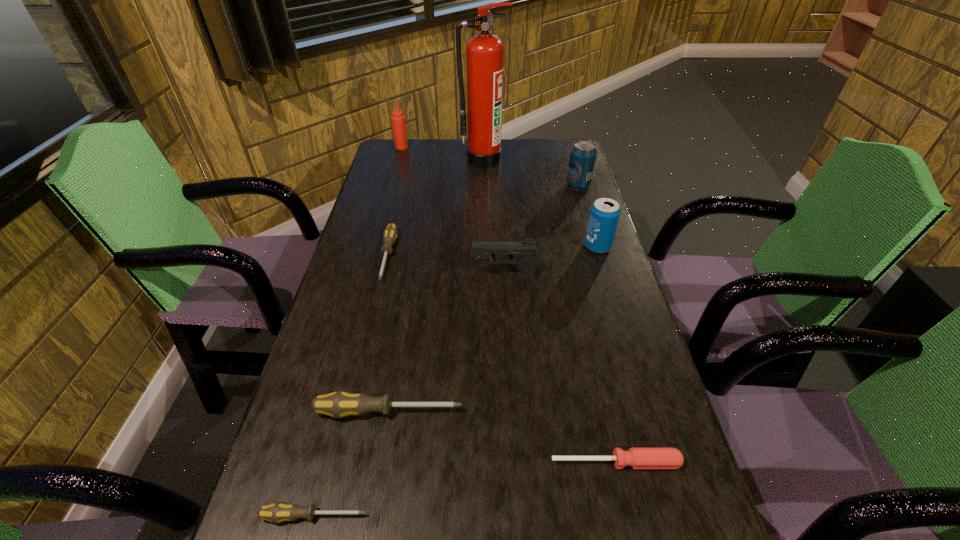
In the image, there is a desktop. In order to click on vacant space at the far edge in this screenshot , I will do (453, 150).

Where is `free point at the left edge`? free point at the left edge is located at coordinates (369, 288).

Identify the location of vacant area at the right edge of the desktop. (561, 238).

The width and height of the screenshot is (960, 540). In order to click on free spot at the far left corner of the desktop in this screenshot , I will do 422,147.

You are a GUI agent. You are given a task and a screenshot of the screen. Output one action in this format:
    pyautogui.click(x=<x>, y=<y>)
    Task: Click on the vacant space at the far right corner of the desktop
    The height and width of the screenshot is (540, 960).
    Given the screenshot: What is the action you would take?
    pyautogui.click(x=574, y=139)

This screenshot has width=960, height=540. What are the coordinates of `free space between the sixth tallest object and the farther soda can` in the screenshot? It's located at (484, 298).

This screenshot has height=540, width=960. Find the location of `vacant region between the fifth shortest object and the red screwdriver`. vacant region between the fifth shortest object and the red screwdriver is located at coordinates (560, 369).

Where is `free spot between the second nearest screwdriver and the smallest gray screwdriver`? free spot between the second nearest screwdriver and the smallest gray screwdriver is located at coordinates (465, 489).

The height and width of the screenshot is (540, 960). I want to click on free space that is in between the second smallest gray screwdriver and the smallest gray screwdriver, so click(350, 386).

Image resolution: width=960 pixels, height=540 pixels. In order to click on free area in between the Tabasco sauce and the nearer soda can in this screenshot , I will do `click(499, 197)`.